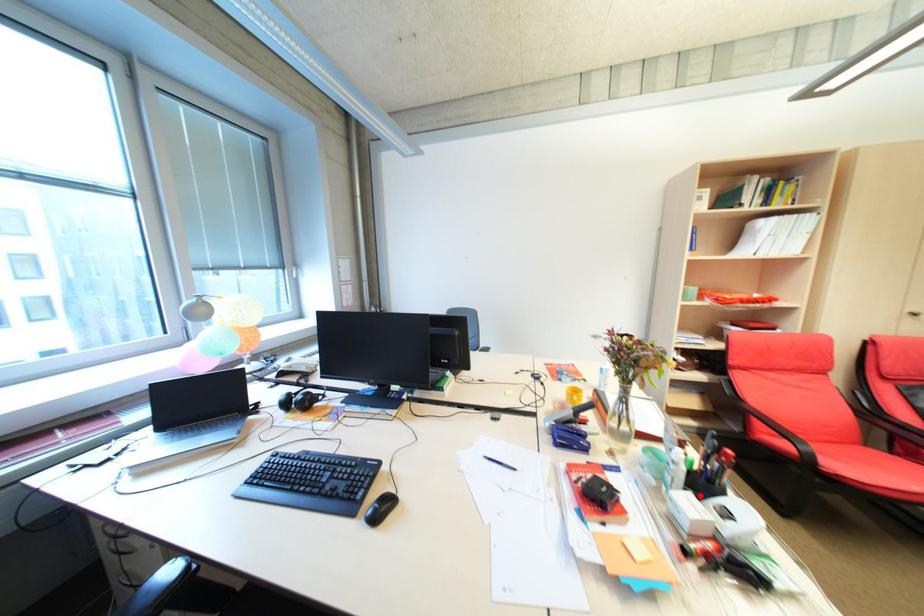
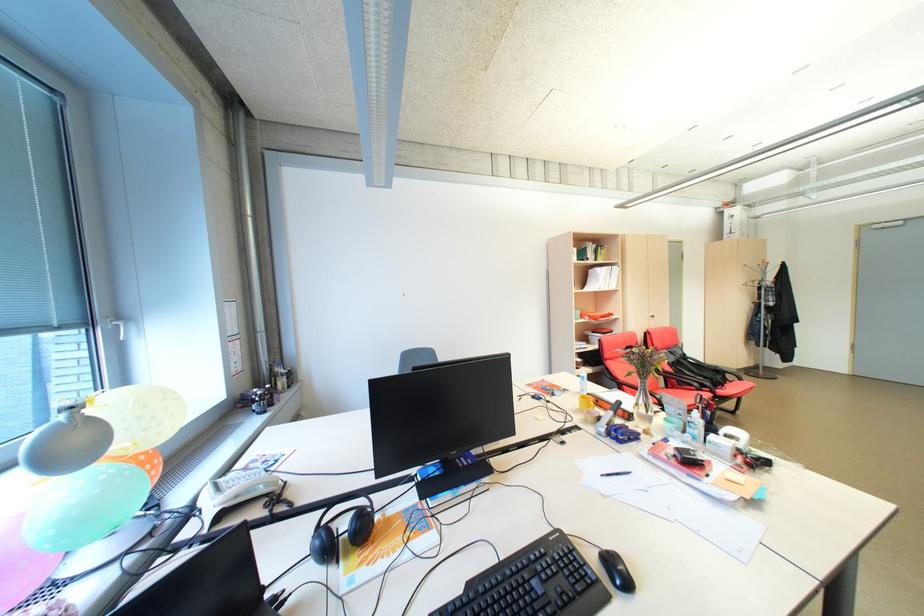
Locate, in the second image, the point that corresponds to the highlighted location in the first image.

(722, 436)